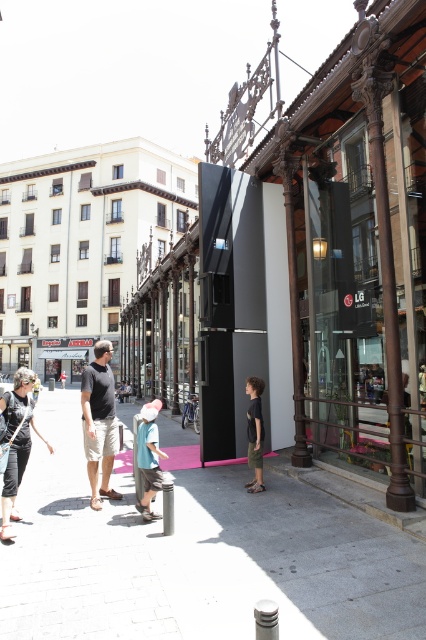
In the urban street scene, there is a matte black jacket at lower left and a pink fabric hat at center. Which object is positioned more to the left?

The matte black jacket at lower left is positioned more to the left than the pink fabric hat at center.

In the scene shown: You are a photographer standing in the urban street scene. You want to take a photo that includes both the point at coordinates point (x=58, y=436) and point (x=256, y=480). Which point should you focus on first to ensure both are in focus?

You should focus on point (x=58, y=436) first because it is closer to you than point (x=256, y=480). This way, the depth of field will likely cover both points effectively.

You are standing in the urban street scene described. You want to walk to the point marked at coordinates (x=244, y=536). How far will you have to walk to reach that point?

The point at coordinates (x=244, y=536) is 5.62 meters away from the viewer, so you will have to walk 5.62 meters to reach it.